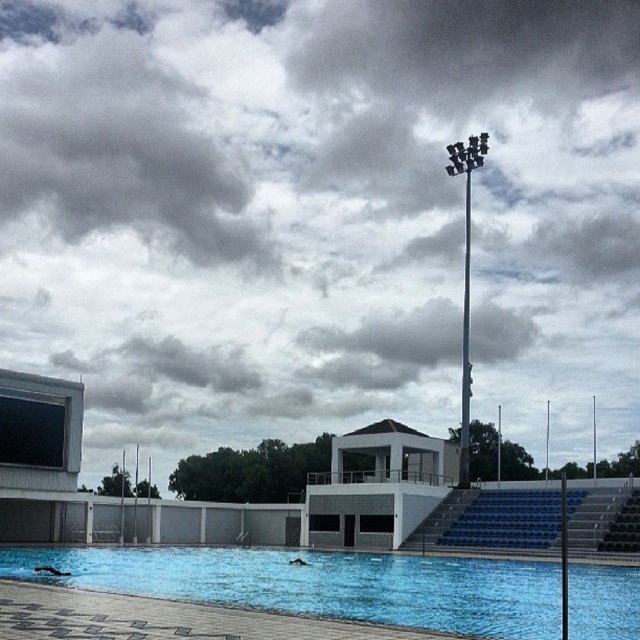
You are a lifeguard standing at the edge of the pool. You need to locate the blue smooth water at center quickly. According to the coordinates provided, where should you look to find it?

The blue smooth water at center is located at coordinates point (x=323, y=584).

You are standing at the point marked by the coordinates point (465, 346), which is the silver metallic pole at upper center. You want to walk straight ahead to the nearest object. Which object will you reach first? The objects in the scene are the modern building structure with a flat roof and large windows on the left side of the frame, the row of trees beyond the low wall adjacent to the building, the tall pole with multiple floodlights in the center right, and the rows of blue stadium style seating to

The point marked by the coordinates point (465, 346) is the silver metallic pole at upper center. Walking straight ahead from this point would lead you directly toward the rows of blue stadium style seating to the right of the pole, as they are positioned closest in that direction compared to the other listed objects.